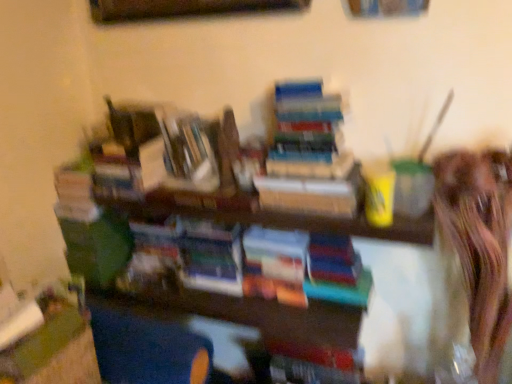
Question: Which direction should I rotate to look at multicolored paper book at center, which is the third book from left to right, — up or down?

Choices:
 (A) up
 (B) down

Answer: (B)

Question: Is hardcover book at center, arranged as the first book when viewed from the left, positioned with its back to hardcover book at center, positioned as the second book in left-to-right order?

Choices:
 (A) no
 (B) yes

Answer: (A)

Question: From the image's perspective, is hardcover book at center, acting as the 4th book starting from the right, located above hardcover book at center, the third book viewed from the right?

Choices:
 (A) no
 (B) yes

Answer: (B)

Question: From a real-world perspective, is hardcover book at center, arranged as the first book when viewed from the left, located higher than hardcover book at center, positioned as the second book in left-to-right order?

Choices:
 (A) yes
 (B) no

Answer: (A)

Question: Considering the relative positions of hardcover book at center, acting as the 4th book starting from the right, and hardcover book at center, positioned as the second book in left-to-right order, in the image provided, is hardcover book at center, acting as the 4th book starting from the right, to the left of hardcover book at center, positioned as the second book in left-to-right order, from the viewer's perspective?

Choices:
 (A) no
 (B) yes

Answer: (B)

Question: Can you confirm if hardcover book at center, acting as the 4th book starting from the right, is bigger than hardcover book at center, the third book viewed from the right?

Choices:
 (A) no
 (B) yes

Answer: (A)

Question: Is hardcover book at center, acting as the 4th book starting from the right, oriented towards hardcover book at center, the third book viewed from the right?

Choices:
 (A) no
 (B) yes

Answer: (A)

Question: Considering the relative sizes of hardcover book at center, the third book viewed from the right, and multicolored paper book at center, which is the third book from left to right, in the image provided, is hardcover book at center, the third book viewed from the right, shorter than multicolored paper book at center, which is the third book from left to right,?

Choices:
 (A) yes
 (B) no

Answer: (A)

Question: Does hardcover book at center, positioned as the second book in left-to-right order, have a larger size compared to multicolored paper book at center, the second book positioned from the right?

Choices:
 (A) no
 (B) yes

Answer: (A)

Question: Is hardcover book at center, positioned as the second book in left-to-right order, in front of multicolored paper book at center, the second book positioned from the right?

Choices:
 (A) no
 (B) yes

Answer: (A)

Question: Can you confirm if hardcover book at center, the third book viewed from the right, is thinner than multicolored paper book at center, the second book positioned from the right?

Choices:
 (A) no
 (B) yes

Answer: (B)

Question: Could you tell me if hardcover book at center, the third book viewed from the right, is facing multicolored paper book at center, which is the third book from left to right?

Choices:
 (A) yes
 (B) no

Answer: (B)

Question: From a real-world perspective, is hardcover book at center, the third book viewed from the right, located beneath multicolored paper book at center, the second book positioned from the right?

Choices:
 (A) no
 (B) yes

Answer: (A)

Question: Are hardcover books at center, positioned as the fourth book in left-to-right order, and hardcover book at center, acting as the 4th book starting from the right, located far from each other?

Choices:
 (A) yes
 (B) no

Answer: (B)